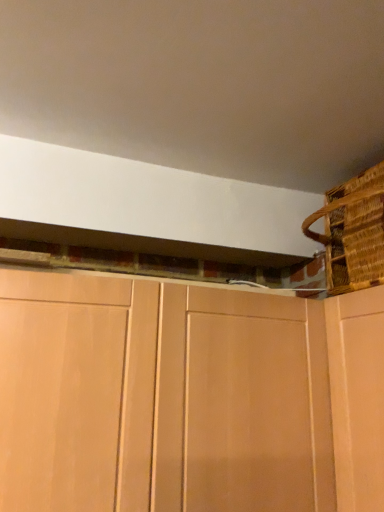
Locate an element on the screen. This screenshot has width=384, height=512. matte wood cupboard at center is located at coordinates (187, 397).

Describe the element at coordinates (187, 397) in the screenshot. I see `matte wood cupboard at center` at that location.

This screenshot has width=384, height=512. Find the location of `matte wood cupboard at center`. matte wood cupboard at center is located at coordinates (187, 397).